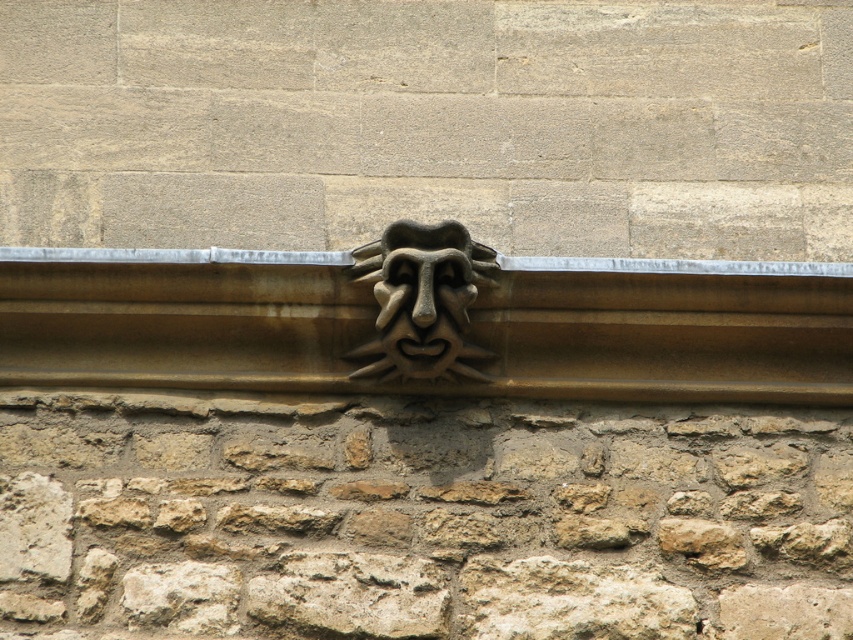
You are an architect analyzing the stone facade. You notice two points marked on the carving. The first point is at coordinate point [212,387] and the second is at point [389,304]. Which of these points is closer to the camera lens?

Point [212,387] is further to the camera than point [389,304], so the point closer to the camera is point [389,304].

You are an architect designing a new building and want to replicate the stone details seen in the image. You have two brown stone elements to place at the center of the facade. The brown rough stone at center and the brown stone ledge at center. Which of these two elements is narrower in width?

The brown rough stone at center is narrower than the brown stone ledge at center because its width is less than the latter.

What are the coordinates of the brown rough stone at center in the image?

The brown rough stone at center is located at coordinates point (421, 518).